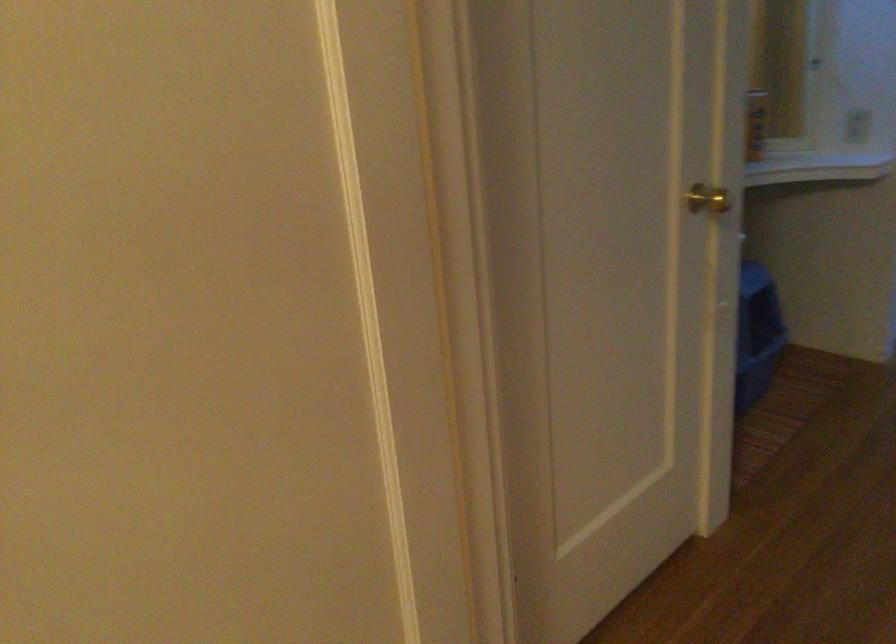
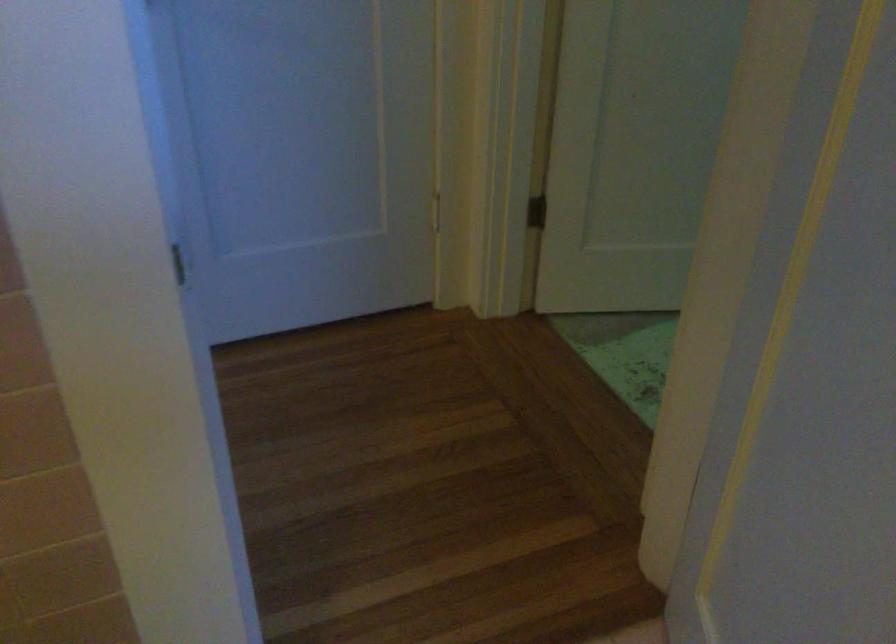
The images are taken continuously from a first-person perspective. In which direction are you moving?

The movement direction of the cameraman is right, forward.